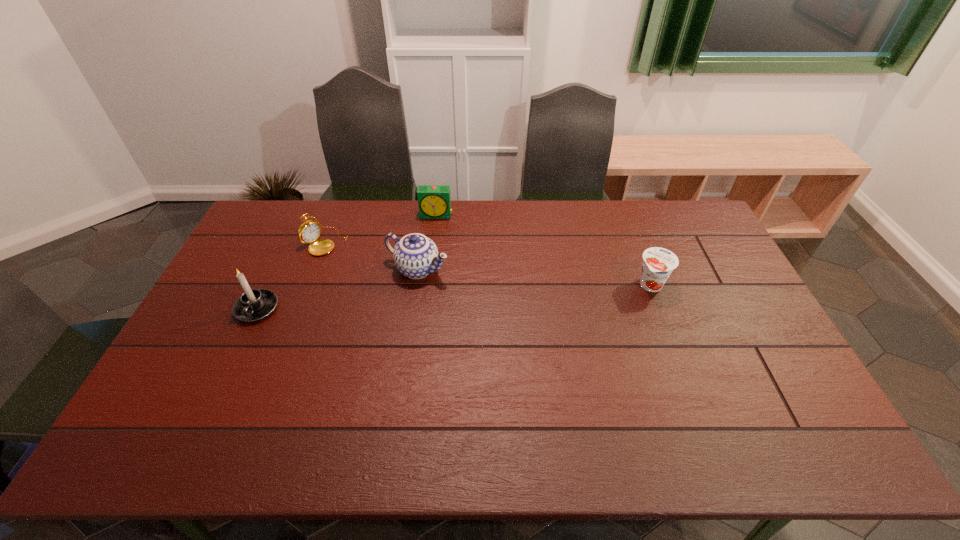
I want to click on free space at the near edge of the desktop, so click(x=577, y=386).

At what (x,y) coordinates should I click in order to perform the action: click on free space at the left edge. Please return your answer as a coordinate pair (x, y). The image size is (960, 540). Looking at the image, I should click on (228, 280).

You are a GUI agent. You are given a task and a screenshot of the screen. Output one action in this format:
    pyautogui.click(x=<x>, y=<y>)
    Task: Click on the vacant space at the right edge of the desktop
    The image size is (960, 540).
    Given the screenshot: What is the action you would take?
    pyautogui.click(x=725, y=278)

The height and width of the screenshot is (540, 960). I want to click on vacant area at the near right corner, so click(787, 410).

You are a GUI agent. You are given a task and a screenshot of the screen. Output one action in this format:
    pyautogui.click(x=<x>, y=<y>)
    Task: Click on the empty space between the alarm clock and the tallest object
    
    Given the screenshot: What is the action you would take?
    [347, 262]

In order to click on free space between the chinaware and the rightmost object in this screenshot , I will do [535, 277].

Find the location of a particular element. The image size is (960, 540). vacant region between the rightmost object and the candle holder is located at coordinates (454, 297).

Where is `free space between the chinaware and the yogurt`? The image size is (960, 540). free space between the chinaware and the yogurt is located at coordinates (535, 277).

At what (x,y) coordinates should I click in order to perform the action: click on empty space that is in between the farthest object and the yogurt. Please return your answer as a coordinate pair (x, y). Looking at the image, I should click on point(543,250).

Locate an element on the screen. The width and height of the screenshot is (960, 540). free space between the rightmost object and the alarm clock is located at coordinates (543, 250).